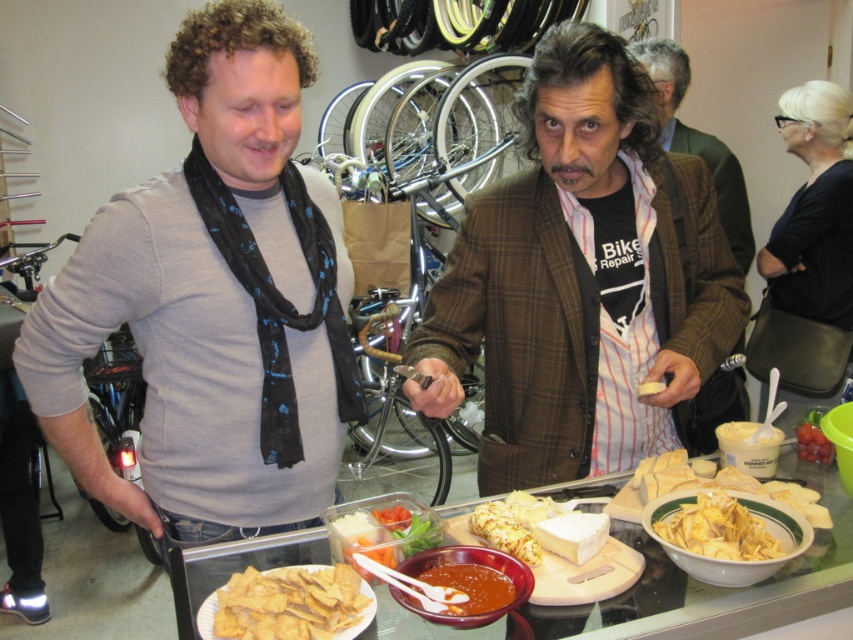
You are a guest at the gathering and want to place a small item on the table without moving any existing items. The brown plaid blazer at center and the translucent plastic container at center are on the table. Can you fit the item between them if it requires 45 centimeters of space?

The brown plaid blazer at center is 44.86 centimeters away from the translucent plastic container at center. Since the required space is 45 centimeters, the item cannot fit between them as there is slightly less space available.

You are hosting a small gathering and need to place the brown plaid blazer at center and the translucent plastic container at center on a shelf. The shelf has limited space. Which item should you place first to ensure both fit?

The brown plaid blazer at center is larger in size than the translucent plastic container at center, so you should place the larger item first to ensure both fit on the shelf.